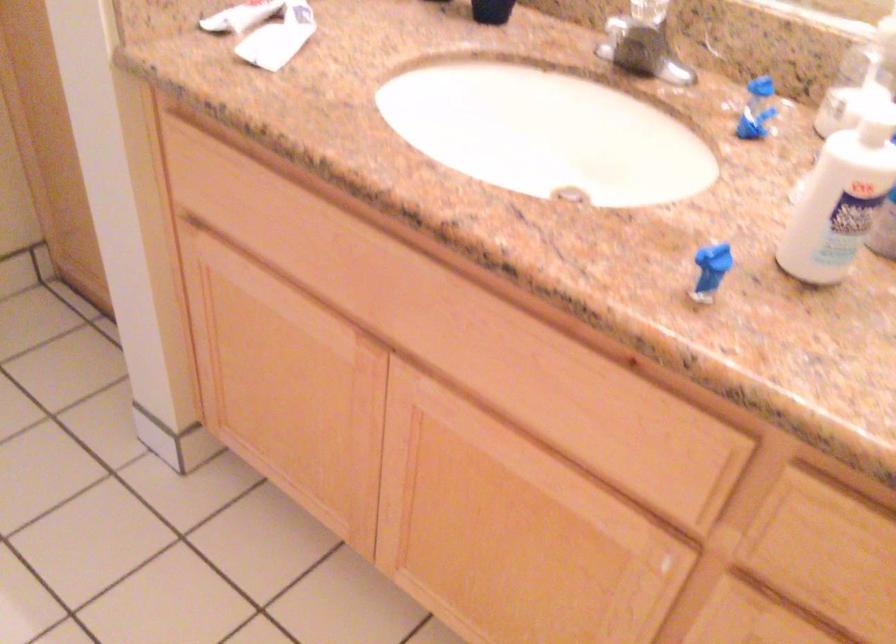
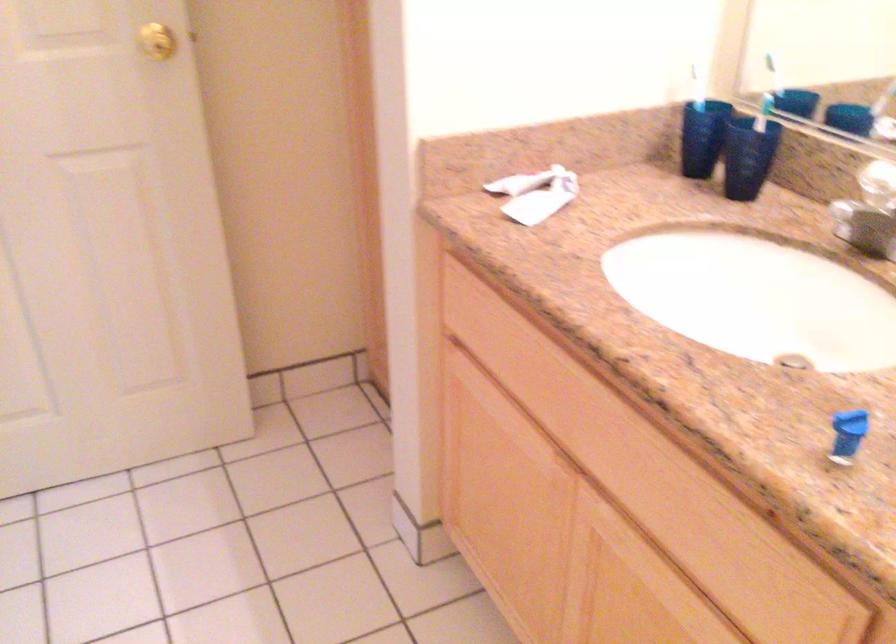
Question: The first image is from the beginning of the video and the second image is from the end. How did the camera likely rotate when shooting the video?

Choices:
 (A) Left
 (B) Right
 (C) Up
 (D) Down

Answer: (A)